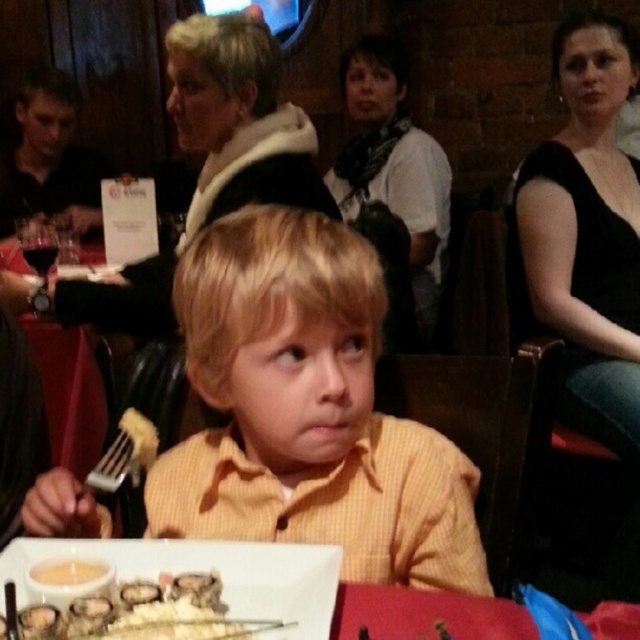
You are a waiter in a restaurant and need to place a new dish on the table. The dish is wider than the yellow striped shirt at center but narrower than the white ceramic plate at lower center. Will the dish fit on the table without overlapping the shirt?

The yellow striped shirt at center has a lesser width compared to the white ceramic plate at lower center. Since the dish is wider than the shirt but narrower than the plate, it may fit on the table as long as it is placed near the plate area where there is enough space. However, the exact placement depends on the table layout not specified here.

You are a waiter in a restaurant. You need to place a new drink order for the customer wearing the yellow striped shirt at center. Where should you place the drink relative to the white ceramic plate at lower center?

The yellow striped shirt at center is to the right of the white ceramic plate at lower center, so you should place the drink to the right of the white ceramic plate at lower center where the customer can easily reach it.

You are a photographer standing at a certain distance from the white ceramic plate at lower center. You want to take a closeup shot of the plate without moving the camera. What adjustment should you make to your camera lens to focus on the plate?

Since the white ceramic plate at lower center is 55.21 centimeters away from the camera, you should adjust the camera lens to a focal length that can capture objects at that distance for proper focus.